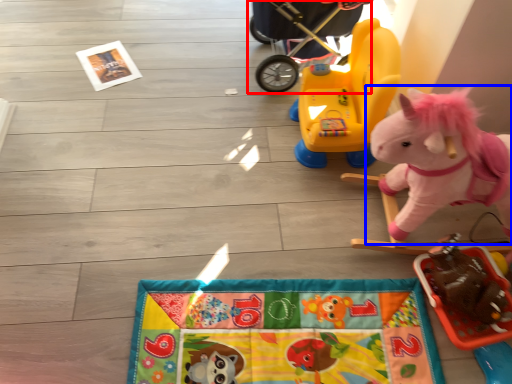
Question: Which object appears closest to the camera in this image, baby carriage (highlighted by a red box) or toy (highlighted by a blue box)?

Choices:
 (A) baby carriage
 (B) toy

Answer: (B)